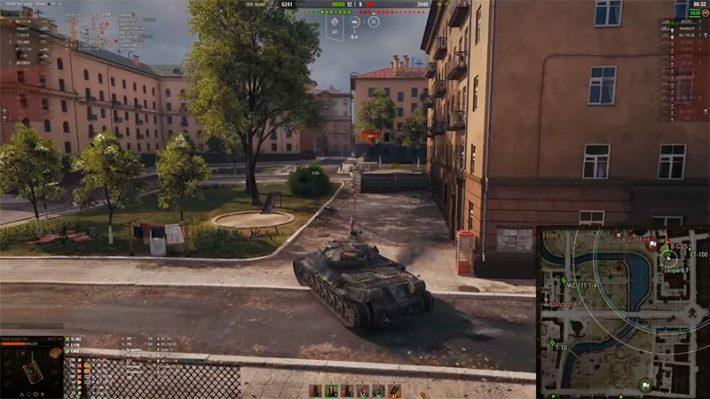
This screenshot has height=399, width=710. In order to click on window in this screenshot , I will do `click(604, 86)`, `click(610, 13)`, `click(598, 157)`, `click(674, 159)`, `click(671, 220)`, `click(596, 218)`.